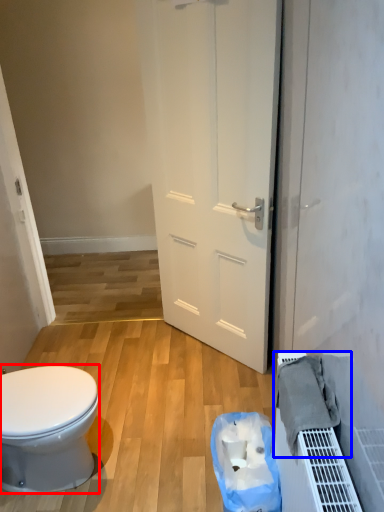
Question: Which object is closer to the camera taking this photo, bidet (highlighted by a red box) or material (highlighted by a blue box)?

Choices:
 (A) bidet
 (B) material

Answer: (B)